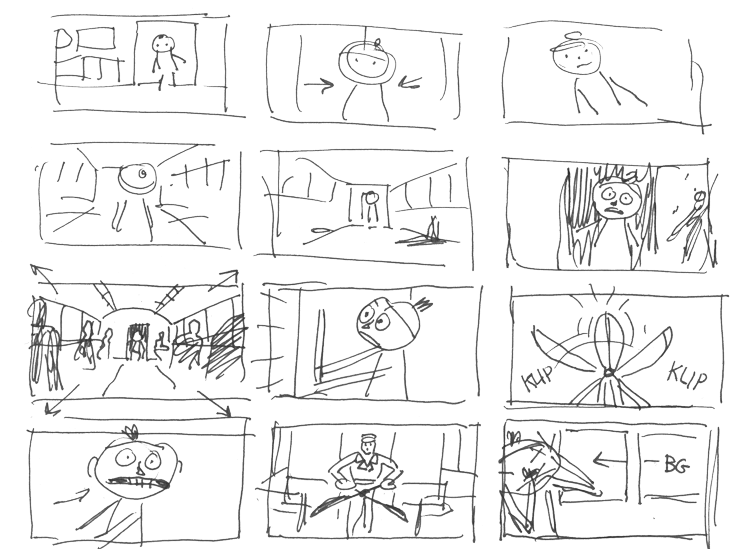
Locate an element on the screen. hall way is located at coordinates (299, 216).